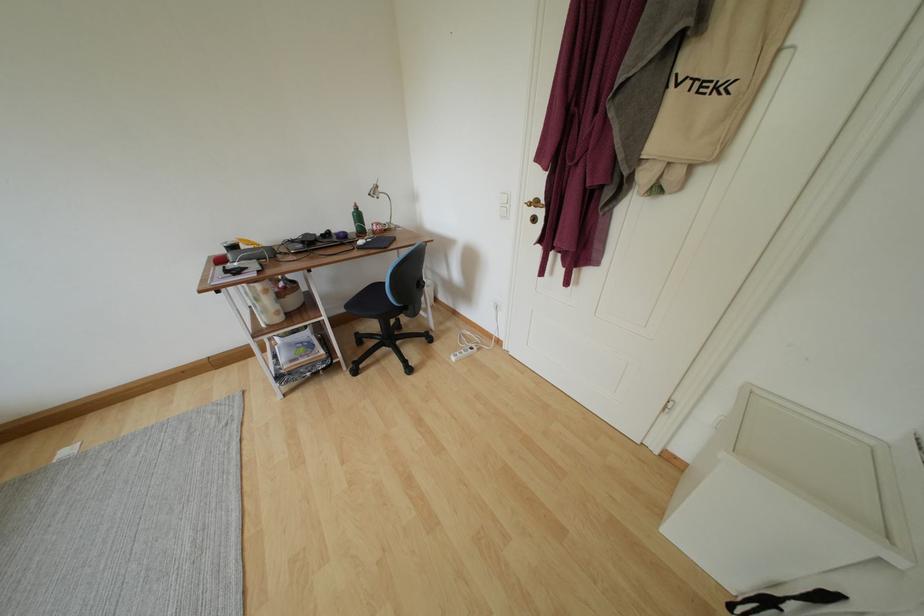
Locate an element on the screen. The image size is (924, 616). gold door handle is located at coordinates (535, 203).